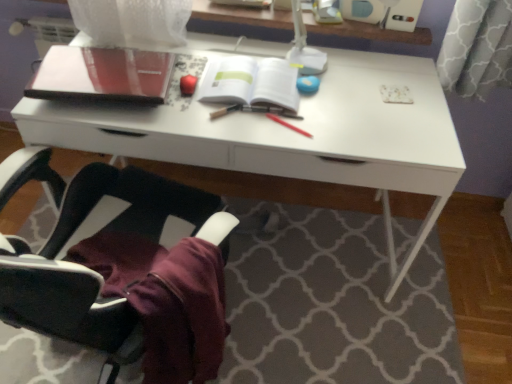
Identify the location of vacant area that is situated to the right of white paper at center. Image resolution: width=512 pixels, height=384 pixels. (337, 109).